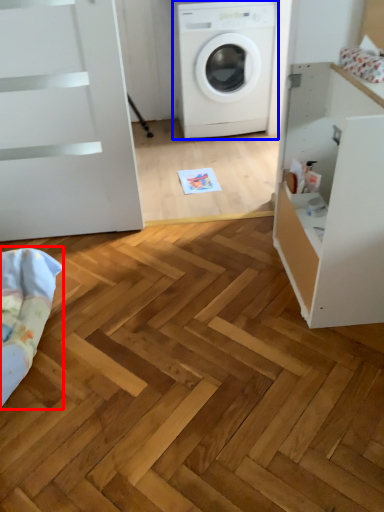
Question: Which of the following is the farthest to the observer, bedding (highlighted by a red box) or washing machine (highlighted by a blue box)?

Choices:
 (A) bedding
 (B) washing machine

Answer: (B)